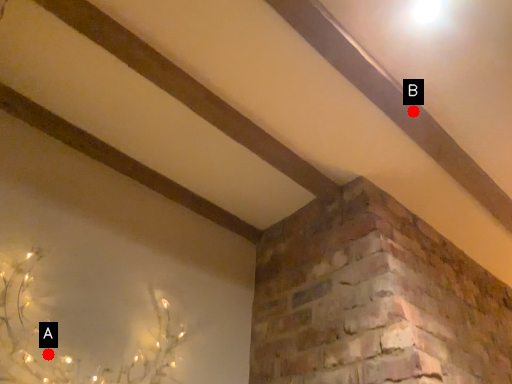
Question: Two points are circled on the image, labeled by A and B beside each circle. Which point appears closest to the camera in this image?

Choices:
 (A) A is closer
 (B) B is closer

Answer: (A)